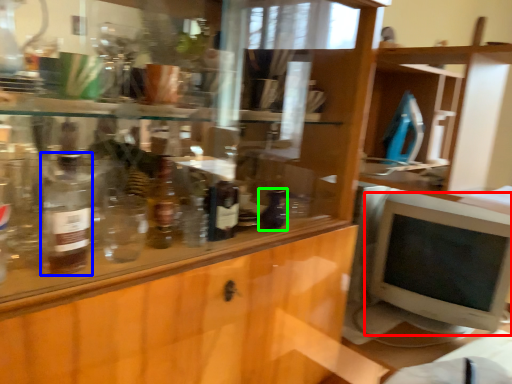
Question: Considering the real-world distances, which object is closest to computer monitor (highlighted by a red box)? bottle (highlighted by a blue box) or bottle (highlighted by a green box).

Choices:
 (A) bottle
 (B) bottle

Answer: (B)